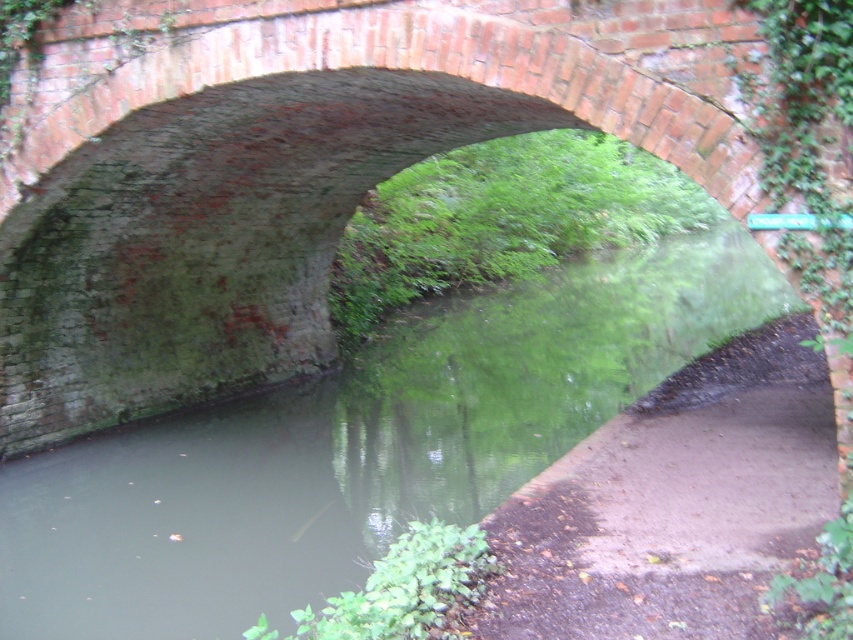
Question: Does brick archway at center have a smaller size compared to green mossy river at center?

Choices:
 (A) yes
 (B) no

Answer: (A)

Question: Does brick archway at center appear over green mossy river at center?

Choices:
 (A) no
 (B) yes

Answer: (B)

Question: Among these objects, which one is farthest from the camera?

Choices:
 (A) brick archway at center
 (B) green mossy river at center

Answer: (B)

Question: Does brick archway at center appear on the right side of green mossy river at center?

Choices:
 (A) no
 (B) yes

Answer: (A)

Question: Which object appears farthest from the camera in this image?

Choices:
 (A) brick archway at center
 (B) green mossy river at center

Answer: (B)